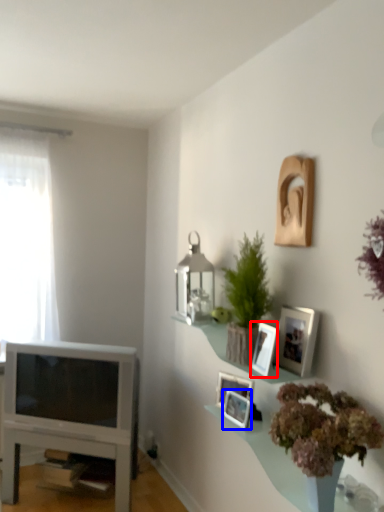
Question: Which of the following is the closest to the observer, picture frame (highlighted by a red box) or picture frame (highlighted by a blue box)?

Choices:
 (A) picture frame
 (B) picture frame

Answer: (A)